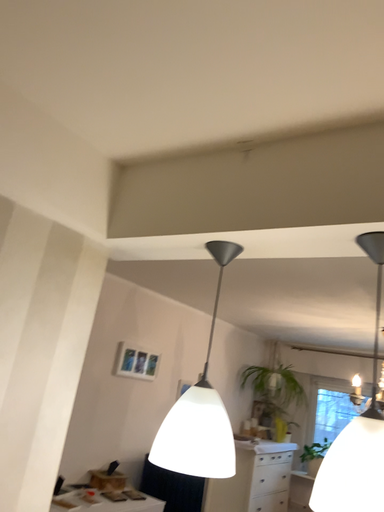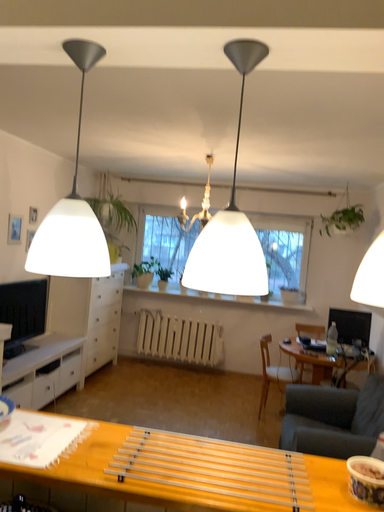
Question: Which way did the camera rotate in the video?

Choices:
 (A) rotated left
 (B) rotated right

Answer: (B)